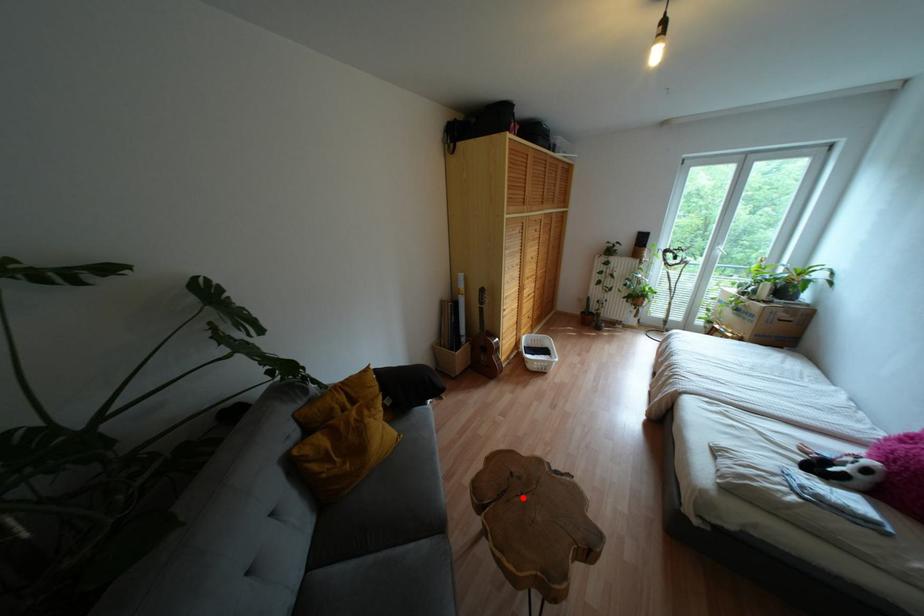
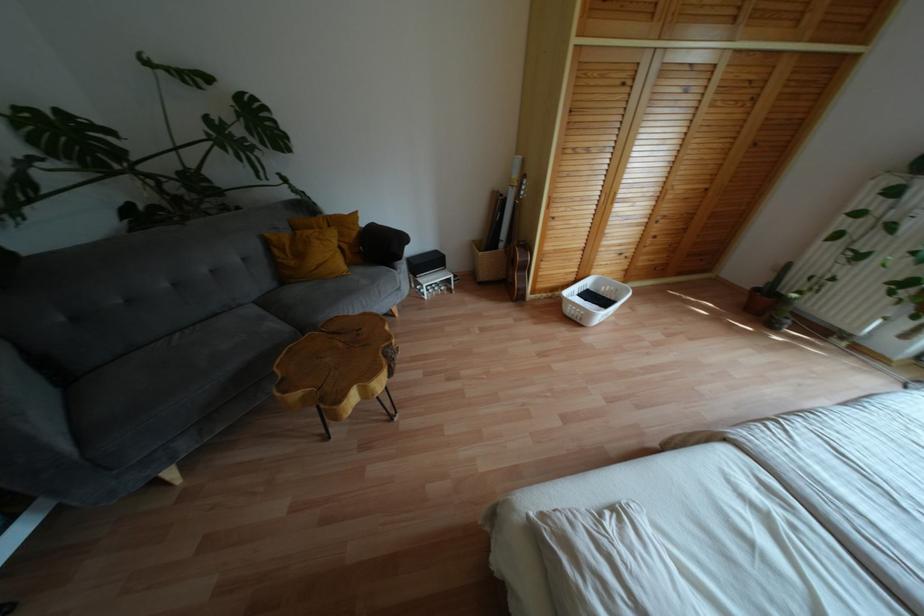
The point at the highlighted location is marked in the first image. Where is the corresponding point in the second image?

(341, 344)